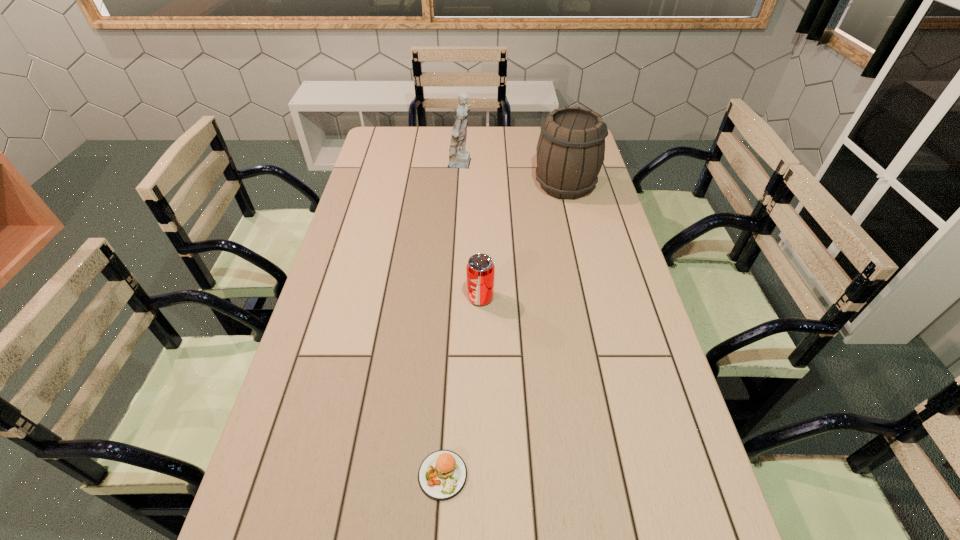
Locate an element on the screen. free region that satisfies the following two spatial constraints: 1. on the back side of the soda can; 2. on the right side of the wine bucket is located at coordinates (480, 185).

Where is `vacant area that satisfies the following two spatial constraints: 1. on the front-facing side of the figurine; 2. on the left side of the wine bucket`? vacant area that satisfies the following two spatial constraints: 1. on the front-facing side of the figurine; 2. on the left side of the wine bucket is located at coordinates (462, 185).

I want to click on vacant space that satisfies the following two spatial constraints: 1. on the back side of the third tallest object; 2. on the left side of the shortest object, so click(453, 298).